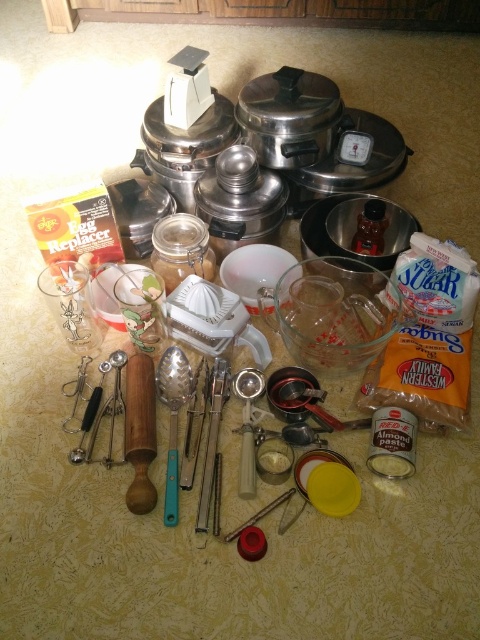
Describe the element at coordinates (172, 419) in the screenshot. This screenshot has height=640, width=480. I see `teal plastic spoon at center` at that location.

Who is more forward, (x=187, y=369) or (x=249, y=490)?

Positioned in front is point (x=249, y=490).

Locate an element on the screen. Image resolution: width=480 pixels, height=640 pixels. teal plastic spoon at center is located at coordinates (172, 419).

Which is above, metallic silver measuring cup at center or silver metallic utensils at center?

metallic silver measuring cup at center is higher up.

In the scene shown: Which is more to the left, metallic silver measuring cup at center or silver metallic utensils at center?

silver metallic utensils at center

Where is `metallic silver measuring cup at center`? metallic silver measuring cup at center is located at coordinates (248, 426).

Can you confirm if teal plastic spoon at center is positioned below silver metallic utensils at center?

No, teal plastic spoon at center is not below silver metallic utensils at center.

Is teal plastic spoon at center smaller than silver metallic utensils at center?

No, teal plastic spoon at center is not smaller than silver metallic utensils at center.

Who is more distant from viewer, (175, 403) or (219, 392)?

The point (175, 403) is behind.

At what (x,y) coordinates should I click in order to perform the action: click on teal plastic spoon at center. Please return your answer as a coordinate pair (x, y). Looking at the image, I should click on (172, 419).